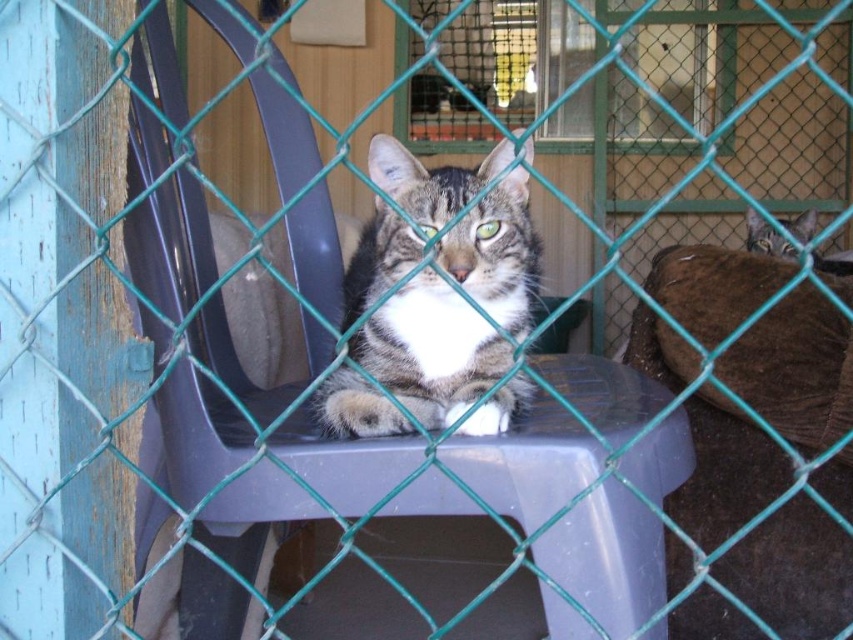
Question: Which object is closer to the camera taking this photo?

Choices:
 (A) tabby fur cat at center
 (B) tabby fur cat at upper right

Answer: (A)

Question: Does tabby fur cat at center have a smaller size compared to tabby fur cat at upper right?

Choices:
 (A) yes
 (B) no

Answer: (A)

Question: Can you confirm if tabby fur cat at center is positioned above tabby fur cat at upper right?

Choices:
 (A) no
 (B) yes

Answer: (A)

Question: Does tabby fur cat at center have a smaller size compared to tabby fur cat at upper right?

Choices:
 (A) no
 (B) yes

Answer: (B)

Question: Which of the following is the closest to the observer?

Choices:
 (A) tabby fur cat at upper right
 (B) tabby fur cat at center

Answer: (B)